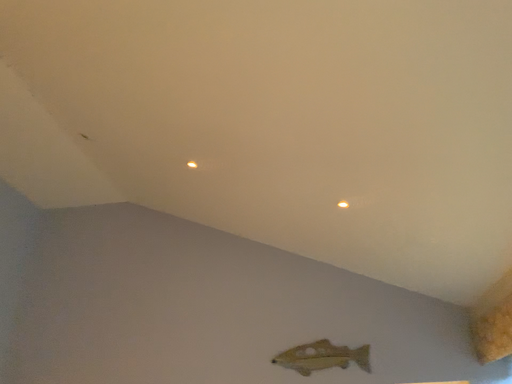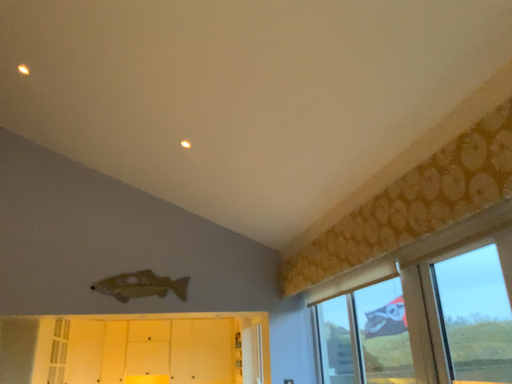
Question: How did the camera likely rotate when shooting the video?

Choices:
 (A) rotated left
 (B) rotated right

Answer: (B)